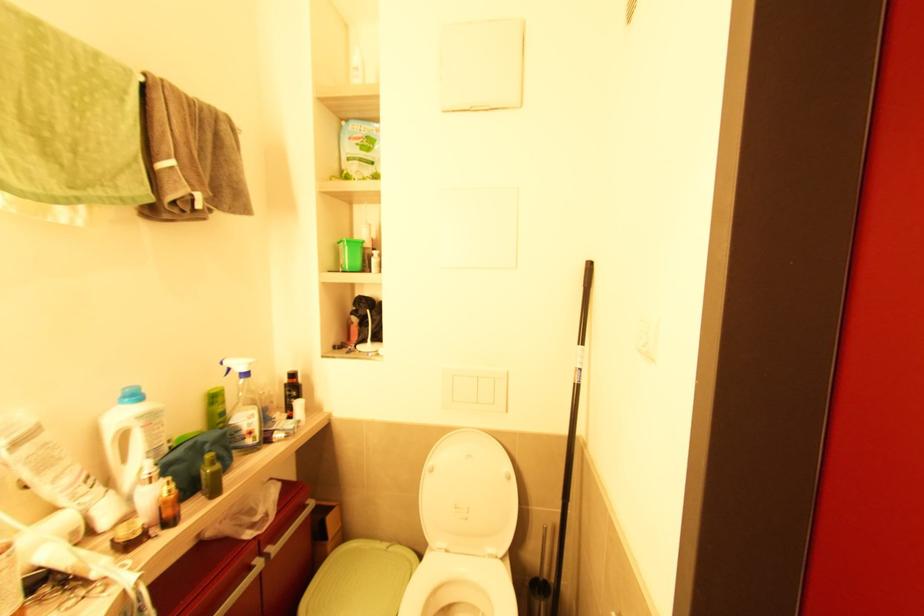
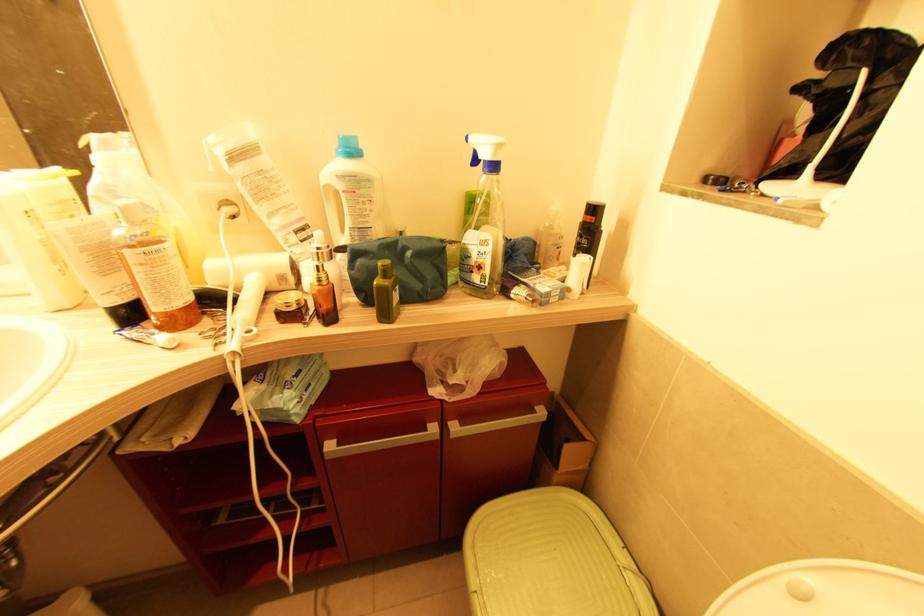
Where in the second image is the point corresponding to the point at 247,440 from the first image?

(473, 273)